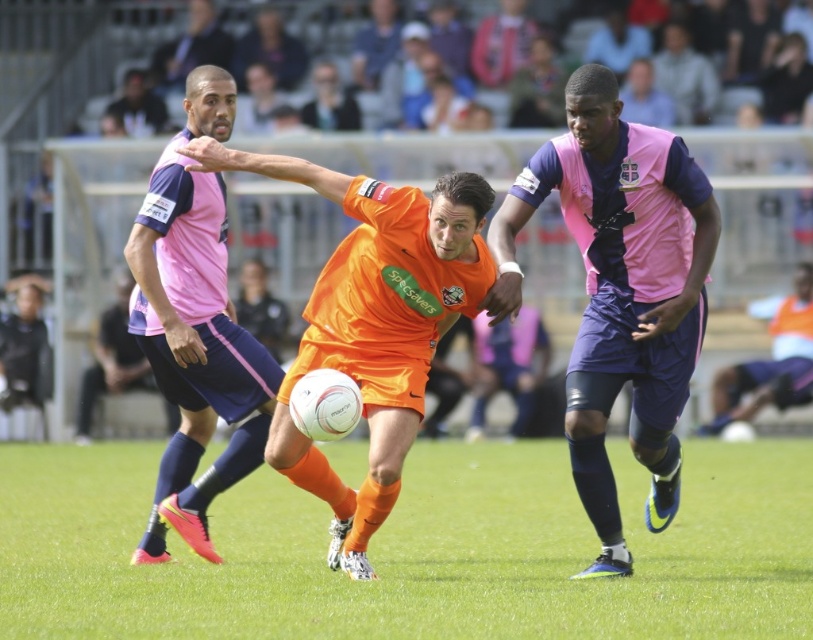
Question: Which point appears closest to the camera in this image?

Choices:
 (A) click(x=179, y=614)
 (B) click(x=644, y=145)
 (C) click(x=220, y=474)

Answer: (A)

Question: Is pink matte jersey at center wider than pink fabric jersey at center?

Choices:
 (A) no
 (B) yes

Answer: (B)

Question: Which of these objects is positioned farthest from the pink fabric jersey at center?

Choices:
 (A) green grass at center
 (B) pink matte jersey at center

Answer: (A)

Question: Which of the following is the farthest from the observer?

Choices:
 (A) orange matte soccer player at center
 (B) green grass at center
 (C) pink fabric jersey at center

Answer: (C)

Question: Is green grass at center in front of pink matte jersey at center?

Choices:
 (A) yes
 (B) no

Answer: (A)

Question: From the image, what is the correct spatial relationship of pink matte jersey at center in relation to orange matte soccer player at center?

Choices:
 (A) left
 (B) right

Answer: (B)